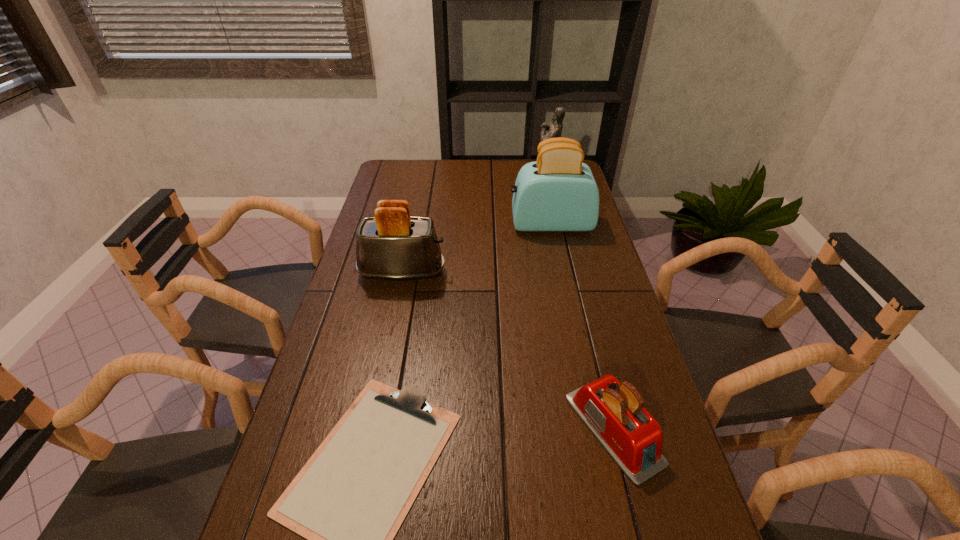
At what (x,y) coordinates should I click in order to perform the action: click on the tallest toaster. Please return your answer as a coordinate pair (x, y). The width and height of the screenshot is (960, 540). Looking at the image, I should click on (558, 192).

Where is `the farthest toaster`? This screenshot has height=540, width=960. the farthest toaster is located at coordinates (558, 192).

The height and width of the screenshot is (540, 960). Find the location of `the farthest object`. the farthest object is located at coordinates (554, 129).

Where is `the second farthest toaster`? the second farthest toaster is located at coordinates (393, 245).

Locate an element on the screen. The height and width of the screenshot is (540, 960). the second shortest toaster is located at coordinates (393, 245).

This screenshot has height=540, width=960. I want to click on the nearest toaster, so click(x=613, y=411).

This screenshot has height=540, width=960. I want to click on the fourth tallest object, so click(x=613, y=411).

You are a GUI agent. You are given a task and a screenshot of the screen. Output one action in this format:
    pyautogui.click(x=<x>, y=<y>)
    Task: Click on the vacant region located 0.290m on the side of the tallest toaster with the lever
    The image size is (960, 540).
    Given the screenshot: What is the action you would take?
    pyautogui.click(x=426, y=224)

At what (x,y) coordinates should I click in order to perform the action: click on free space located 0.180m on the side of the tallest toaster with the lever. Please return your answer as a coordinate pair (x, y). The image size is (960, 540). Looking at the image, I should click on (458, 224).

Image resolution: width=960 pixels, height=540 pixels. Find the location of `free space located on the side of the tallest toaster with the lever`. free space located on the side of the tallest toaster with the lever is located at coordinates (487, 224).